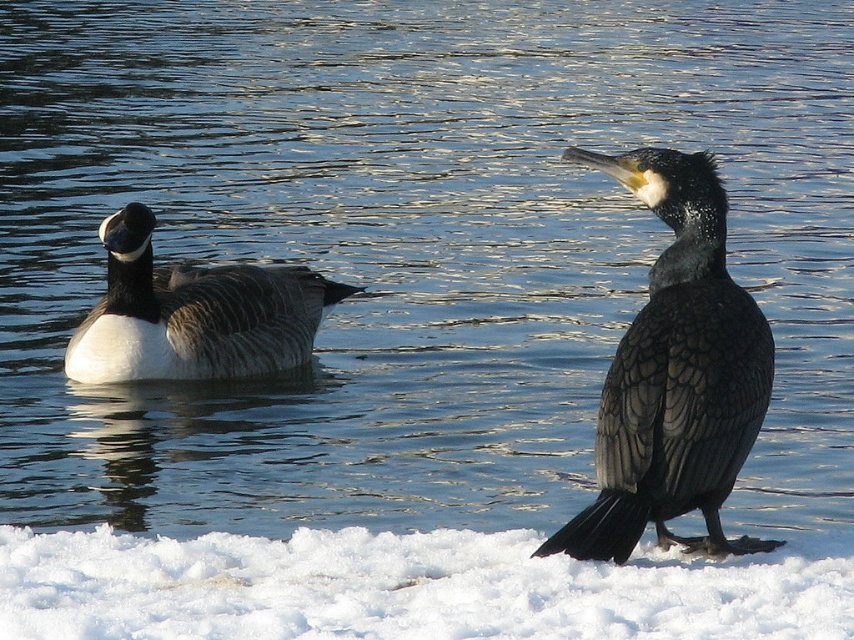
Is white fluffy snow at lower center wider than white matte duck at left?

Correct, the width of white fluffy snow at lower center exceeds that of white matte duck at left.

Which is in front, point (712, 616) or point (240, 298)?

Point (712, 616) is more forward.

Identify the location of white fluffy snow at lower center. Image resolution: width=854 pixels, height=640 pixels. (408, 588).

Between dark gray feathers at center and white matte duck at left, which one appears on the left side from the viewer's perspective?

Positioned to the left is white matte duck at left.

Who is more distant from viewer, [653,262] or [281,330]?

Point [281,330]

Locate an element on the screen. The image size is (854, 640). dark gray feathers at center is located at coordinates (676, 374).

From the picture: Is white fluffy snow at lower center positioned at the back of dark gray feathers at center?

No.

Can you confirm if white fluffy snow at lower center is positioned to the left of dark gray feathers at center?

Yes, white fluffy snow at lower center is to the left of dark gray feathers at center.

Measure the distance between point (x=398, y=609) and camera.

3.77 meters

I want to click on white fluffy snow at lower center, so click(x=408, y=588).